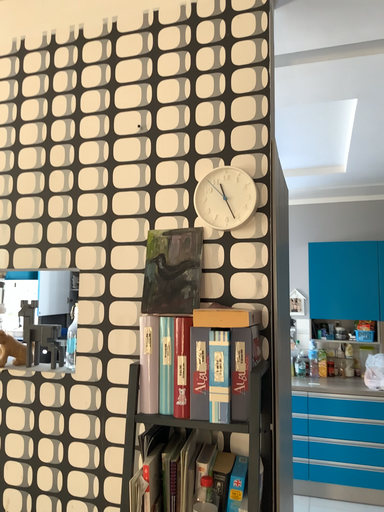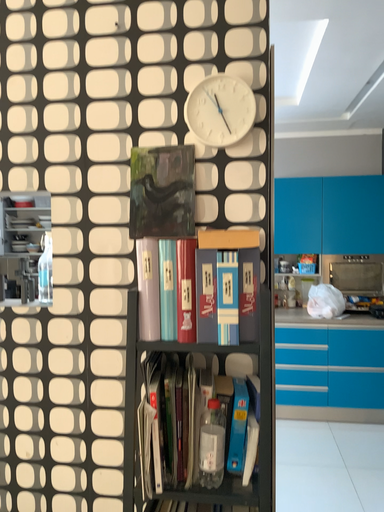
Question: Which way did the camera rotate in the video?

Choices:
 (A) rotated upward
 (B) rotated downward

Answer: (B)